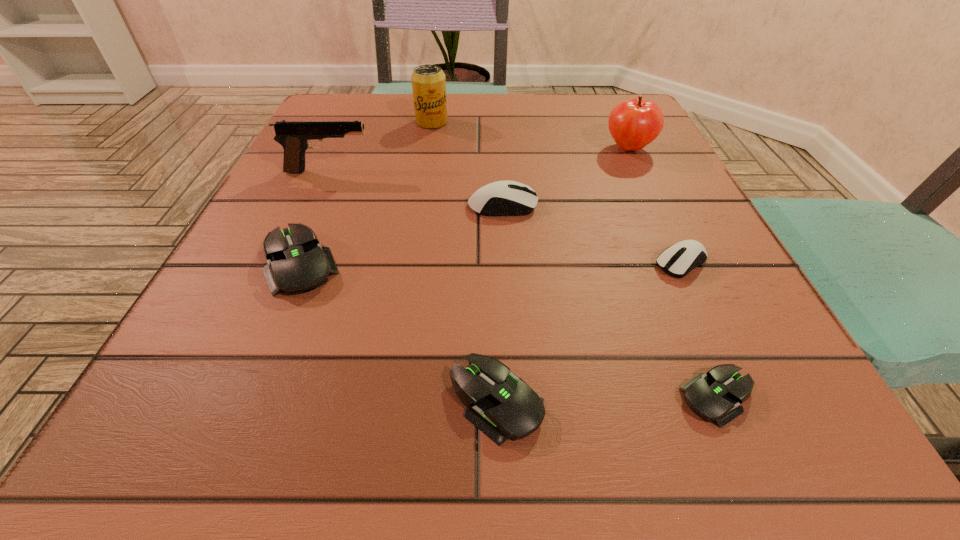
Where is `vacant space that's between the leftmost gray computer mouse and the apple`? The height and width of the screenshot is (540, 960). vacant space that's between the leftmost gray computer mouse and the apple is located at coordinates (466, 206).

Locate an element on the screen. free spot between the black pistol and the beer can is located at coordinates (380, 146).

I want to click on empty location between the smaller white mouse and the red apple, so click(656, 206).

Where is `free spot between the rightmost gray computer mouse and the nearer white mouse`? free spot between the rightmost gray computer mouse and the nearer white mouse is located at coordinates (700, 330).

The height and width of the screenshot is (540, 960). What are the coordinates of `object that can be found as the fifth closest to the smallest gray computer mouse` in the screenshot? It's located at (633, 124).

Identify which object is located as the nearest to the red apple. Please provide its 2D coordinates. Your answer should be formatted as a tuple, i.e. [(x, y)], where the tuple contains the x and y coordinates of a point satisfying the conditions above.

[(502, 198)]

Select which computer mouse appears as the third closest to the leftmost gray computer mouse. Please provide its 2D coordinates. Your answer should be formatted as a tuple, i.e. [(x, y)], where the tuple contains the x and y coordinates of a point satisfying the conditions above.

[(715, 395)]

The height and width of the screenshot is (540, 960). In order to click on computer mouse that stands as the third closest to the right white mouse in this screenshot , I will do `click(504, 406)`.

Locate which gray computer mouse is the closest to the leftmost gray computer mouse. Please provide its 2D coordinates. Your answer should be formatted as a tuple, i.e. [(x, y)], where the tuple contains the x and y coordinates of a point satisfying the conditions above.

[(504, 406)]

Where is `the closest gray computer mouse to the beer can`? the closest gray computer mouse to the beer can is located at coordinates (297, 263).